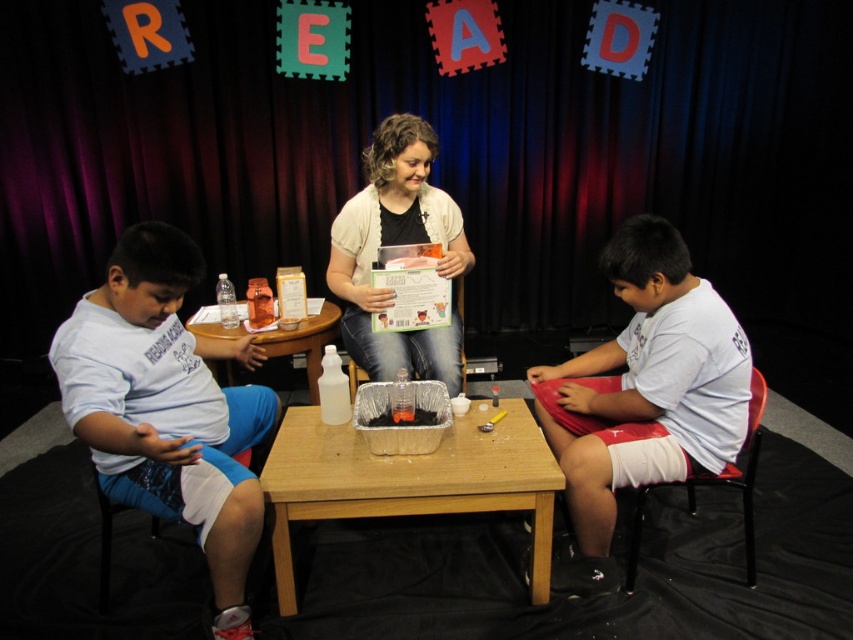
You are a photographer trying to capture a clear shot of the translucent plastic container at center without the white matte cardigan at center blocking it. What should you do?

The white matte cardigan at center is closer to you than the translucent plastic container at center, so you should move your position to angle around or behind the white matte cardigan at center to get an unobstructed view of the translucent plastic container at center.

You are a photographer setting up for a photoshoot at the event. You need to position a light source so it illuminates both the white matte cardigan at center and the translucent plastic table at center without casting harsh shadows. Considering their heights, which object should the light be placed higher above to achieve this?

The light should be placed higher above the white matte cardigan at center since it is taller than the translucent plastic table at center, ensuring both are evenly illuminated without harsh shadows.

You are standing in front of the wooden table at center and want to place a book that requires 6 feet of space to open fully. Can you open it completely without moving the table?

The distance between you and the wooden table at center is 5.87 feet, which is less than the required 6 feet. Therefore, you cannot open the book fully without moving the table.